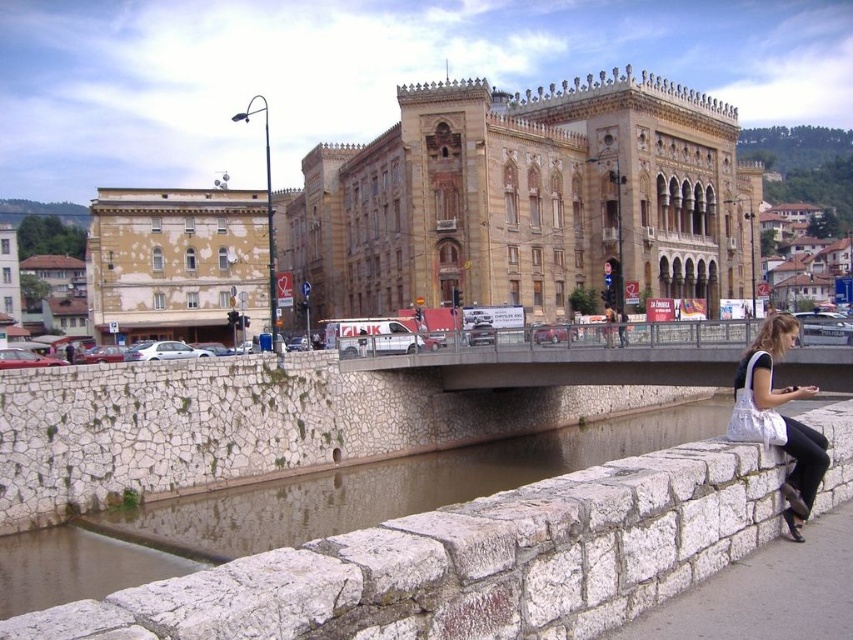
You are standing on the canal side and want to take a photo of the yellowish beige stone building at left. If your camera can focus on objects up to 70 meters away, will it be able to capture the building clearly?

The yellowish beige stone building at left is 67.53 meters from viewer, which is within the camera focus range of up to 70 meters. Therefore, the camera can capture the building clearly.

You are a tourist standing at the canal edge near the historic building. You want to cross the canal to reach the other side. The concrete bridge at center and the white fabric bag at lower right are in your view. Which direction should you walk to reach the bridge first?

You should walk towards the left direction since the concrete bridge at center is to the left of the white fabric bag at lower right, meaning the bridge is closer to your current position on the right side of the image.